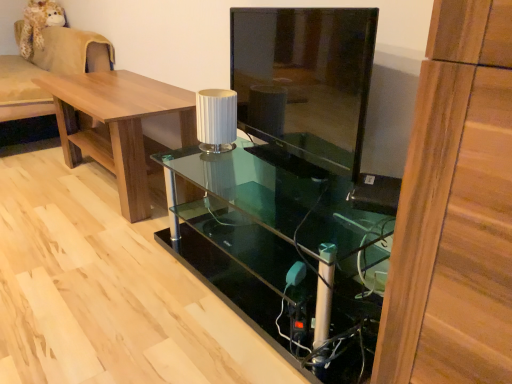
Locate an element on the screen. This screenshot has width=512, height=384. blank space situated above transparent glass tv stand at center (from a real-world perspective) is located at coordinates (296, 4).